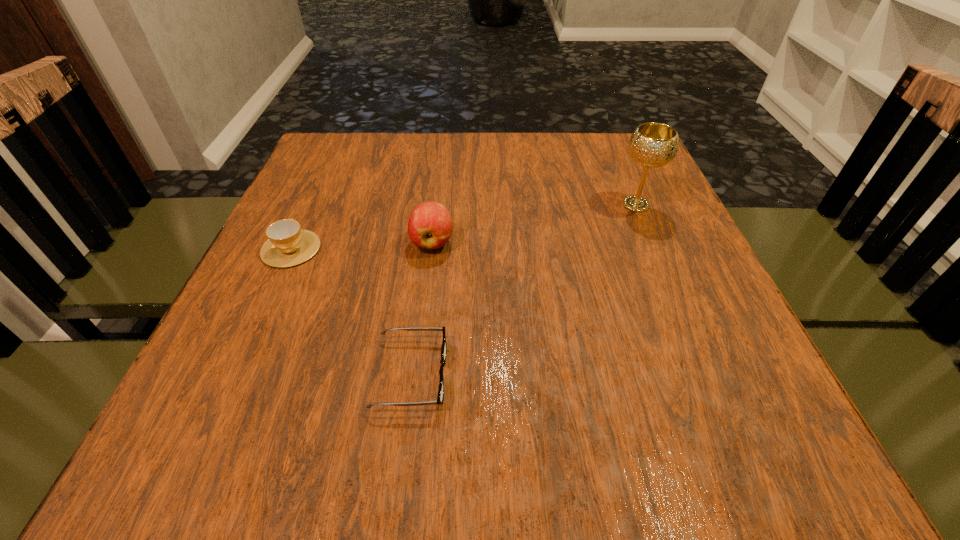
You are a GUI agent. You are given a task and a screenshot of the screen. Output one action in this format:
    pyautogui.click(x=<x>, y=<y>)
    Task: Click on the vacant space that satisfies the following two spatial constraints: 1. with the handle on the side of the third shortest object; 2. on the right side of the leftmost object
    Image resolution: width=960 pixels, height=540 pixels.
    Given the screenshot: What is the action you would take?
    pyautogui.click(x=294, y=242)